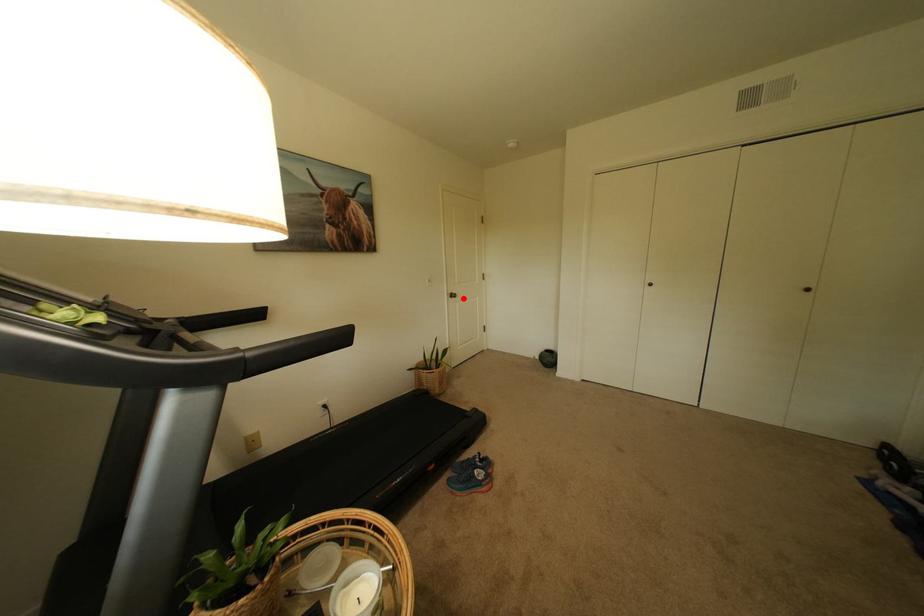
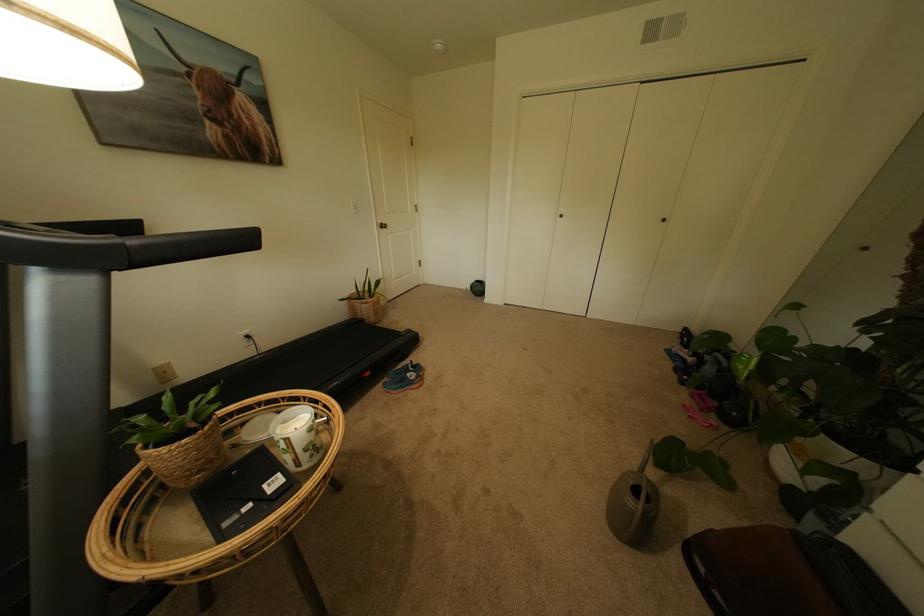
In the second image, find the point that corresponds to the highlighted location in the first image.

(394, 229)